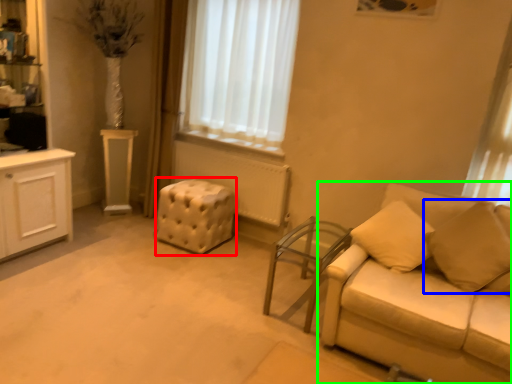
Question: Considering the real-world distances, which object is farthest from stool (highlighted by a red box)? pillow (highlighted by a blue box) or studio couch (highlighted by a green box)?

Choices:
 (A) pillow
 (B) studio couch

Answer: (A)